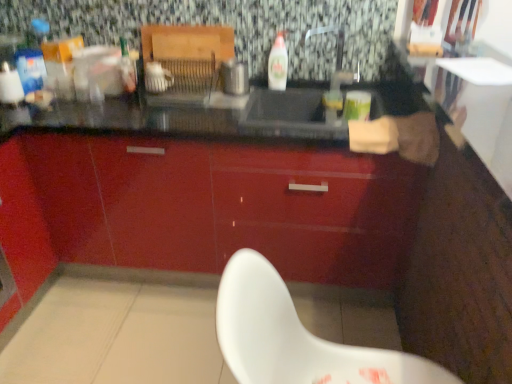
Question: Does white plastic chair at lower center have a smaller size compared to glossy red cabinet at center?

Choices:
 (A) yes
 (B) no

Answer: (A)

Question: Does white plastic chair at lower center have a greater height compared to glossy red cabinet at center?

Choices:
 (A) no
 (B) yes

Answer: (A)

Question: Is glossy red cabinet at center completely or partially inside white plastic chair at lower center?

Choices:
 (A) yes
 (B) no

Answer: (B)

Question: Does white plastic chair at lower center come in front of glossy red cabinet at center?

Choices:
 (A) no
 (B) yes

Answer: (B)

Question: From a real-world perspective, is white plastic chair at lower center positioned over glossy red cabinet at center based on gravity?

Choices:
 (A) yes
 (B) no

Answer: (A)

Question: From the image's perspective, relative to metallic silver toaster at center, is white glossy bottle at center above or below?

Choices:
 (A) below
 (B) above

Answer: (B)

Question: Which is correct: white glossy bottle at center is inside metallic silver toaster at center, or outside of it?

Choices:
 (A) inside
 (B) outside

Answer: (B)

Question: Is white glossy bottle at center wider or thinner than metallic silver toaster at center?

Choices:
 (A) wide
 (B) thin

Answer: (B)

Question: From a real-world perspective, is white glossy bottle at center positioned above or below metallic silver toaster at center?

Choices:
 (A) below
 (B) above

Answer: (B)

Question: Choose the correct answer: Is glossy red cabinet at center inside white plastic chair at lower center or outside it?

Choices:
 (A) outside
 (B) inside

Answer: (A)

Question: Is glossy red cabinet at center in front of or behind white plastic chair at lower center in the image?

Choices:
 (A) front
 (B) behind

Answer: (B)

Question: Is point (292, 173) closer or farther from the camera than point (267, 311)?

Choices:
 (A) farther
 (B) closer

Answer: (A)

Question: From the image's perspective, is glossy red cabinet at center positioned above or below white plastic chair at lower center?

Choices:
 (A) above
 (B) below

Answer: (A)

Question: Is metallic silver toaster at center spatially inside white plastic chair at lower center, or outside of it?

Choices:
 (A) outside
 (B) inside

Answer: (A)

Question: Is metallic silver toaster at center taller or shorter than white plastic chair at lower center?

Choices:
 (A) short
 (B) tall

Answer: (A)